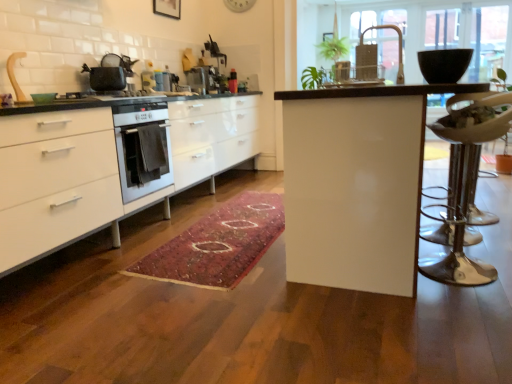
Question: Is matte black pot at upper left located outside metallic gold faucet at upper center?

Choices:
 (A) no
 (B) yes

Answer: (B)

Question: Is matte black pot at upper left positioned in front of metallic gold faucet at upper center?

Choices:
 (A) no
 (B) yes

Answer: (A)

Question: Is matte black pot at upper left further to the viewer compared to metallic gold faucet at upper center?

Choices:
 (A) no
 (B) yes

Answer: (B)

Question: From the image's perspective, is matte black pot at upper left located above metallic gold faucet at upper center?

Choices:
 (A) yes
 (B) no

Answer: (B)

Question: Is matte black pot at upper left bigger than metallic gold faucet at upper center?

Choices:
 (A) no
 (B) yes

Answer: (B)

Question: From their relative heights in the image, would you say metallic silver toaster at center, arranged as the 2th appliance when viewed from the front, is taller or shorter than rug with intricate patterns at center?

Choices:
 (A) short
 (B) tall

Answer: (B)

Question: Is metallic silver toaster at center, which is counted as the second appliance, starting from the left, in front of or behind rug with intricate patterns at center in the image?

Choices:
 (A) behind
 (B) front

Answer: (A)

Question: In terms of size, does metallic silver toaster at center, which is counted as the second appliance, starting from the left, appear bigger or smaller than rug with intricate patterns at center?

Choices:
 (A) small
 (B) big

Answer: (A)

Question: Is metallic silver toaster at center, which is the 1th appliance from back to front, spatially inside rug with intricate patterns at center, or outside of it?

Choices:
 (A) outside
 (B) inside

Answer: (A)

Question: Looking at their shapes, would you say rug with intricate patterns at center is wider or thinner than metallic gold faucet at upper center?

Choices:
 (A) wide
 (B) thin

Answer: (A)

Question: In the image, is rug with intricate patterns at center on the left side or the right side of metallic gold faucet at upper center?

Choices:
 (A) left
 (B) right

Answer: (A)

Question: Do you think rug with intricate patterns at center is within metallic gold faucet at upper center, or outside of it?

Choices:
 (A) outside
 (B) inside

Answer: (A)

Question: In terms of size, does rug with intricate patterns at center appear bigger or smaller than metallic gold faucet at upper center?

Choices:
 (A) small
 (B) big

Answer: (B)

Question: Looking at the image, does matte black pot at upper left seem bigger or smaller compared to metallic silver swivel chair at right?

Choices:
 (A) small
 (B) big

Answer: (A)

Question: Would you say matte black pot at upper left is to the left or to the right of metallic silver swivel chair at right in the picture?

Choices:
 (A) left
 (B) right

Answer: (A)